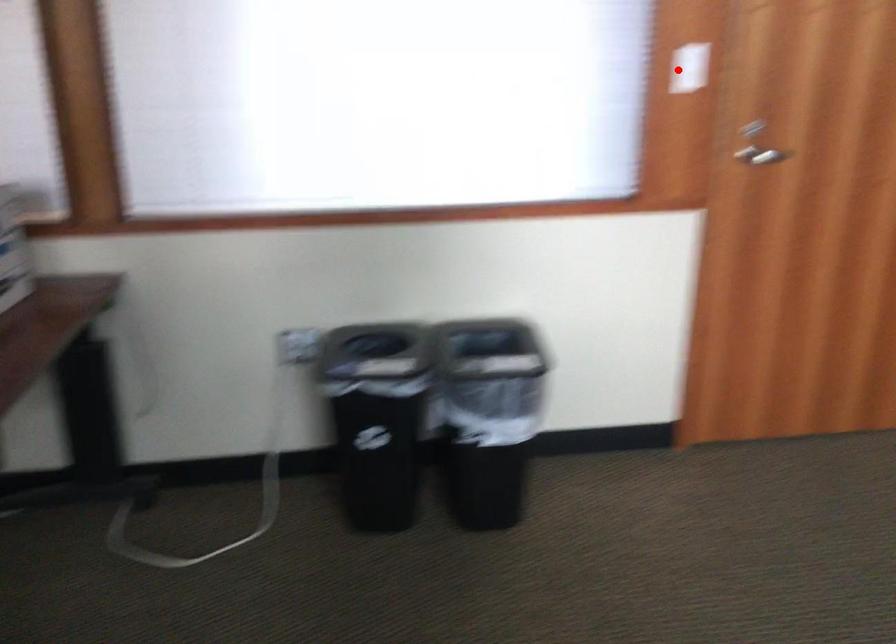
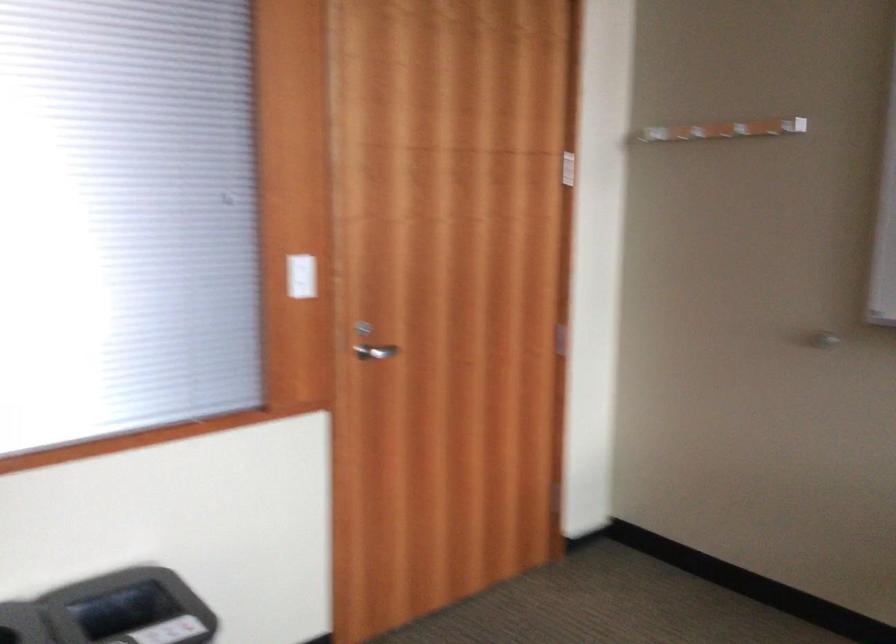
Find the pixel in the second image that matches the highlighted location in the first image.

(300, 276)